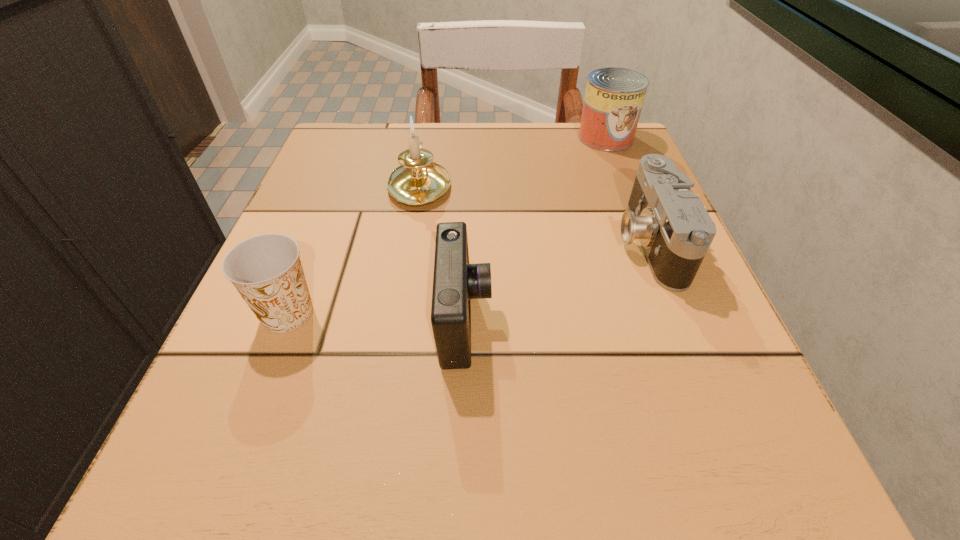
Locate an element on the screen. The width and height of the screenshot is (960, 540). object located at the far right corner is located at coordinates (614, 97).

Locate an element on the screen. This screenshot has width=960, height=540. free space at the far edge is located at coordinates (444, 166).

The height and width of the screenshot is (540, 960). In order to click on vacant area at the near edge of the desktop in this screenshot , I will do `click(408, 483)`.

The height and width of the screenshot is (540, 960). Find the location of `vacant space at the left edge`. vacant space at the left edge is located at coordinates (346, 341).

In the image, there is a desktop. Where is `free space at the right edge`? The height and width of the screenshot is (540, 960). free space at the right edge is located at coordinates (756, 408).

You are a GUI agent. You are given a task and a screenshot of the screen. Output one action in this format:
    pyautogui.click(x=<x>, y=<y>)
    Task: Click on the free location at the far left corner of the desktop
    The height and width of the screenshot is (540, 960).
    Given the screenshot: What is the action you would take?
    pyautogui.click(x=331, y=138)

Where is `free spot between the left camera and the leftmost object`? The width and height of the screenshot is (960, 540). free spot between the left camera and the leftmost object is located at coordinates (376, 317).

The height and width of the screenshot is (540, 960). Identify the location of empty space that is in between the candle holder and the farthest object. (513, 161).

At what (x,y) coordinates should I click in order to perform the action: click on free space between the farthest object and the candle holder. Please return your answer as a coordinate pair (x, y). Looking at the image, I should click on (513, 161).

Find the location of a particular element. free space between the right camera and the left camera is located at coordinates (557, 281).